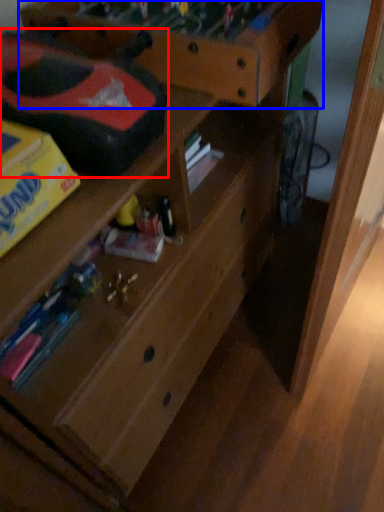
Question: Which point is further to the camera, toy car (highlighted by a red box) or shelf (highlighted by a blue box)?

Choices:
 (A) toy car
 (B) shelf

Answer: (B)